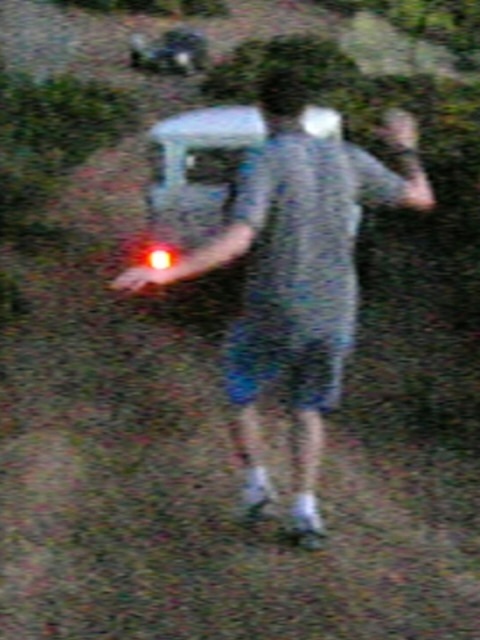
Question: Does matte gray shirt at center appear under white plastic car at center?

Choices:
 (A) yes
 (B) no

Answer: (A)

Question: Does matte gray shirt at center lie behind white plastic car at center?

Choices:
 (A) yes
 (B) no

Answer: (B)

Question: Does matte gray shirt at center have a smaller size compared to white plastic car at center?

Choices:
 (A) yes
 (B) no

Answer: (B)

Question: Which of the following is the closest to the observer?

Choices:
 (A) 394,132
 (B) 216,205

Answer: (A)